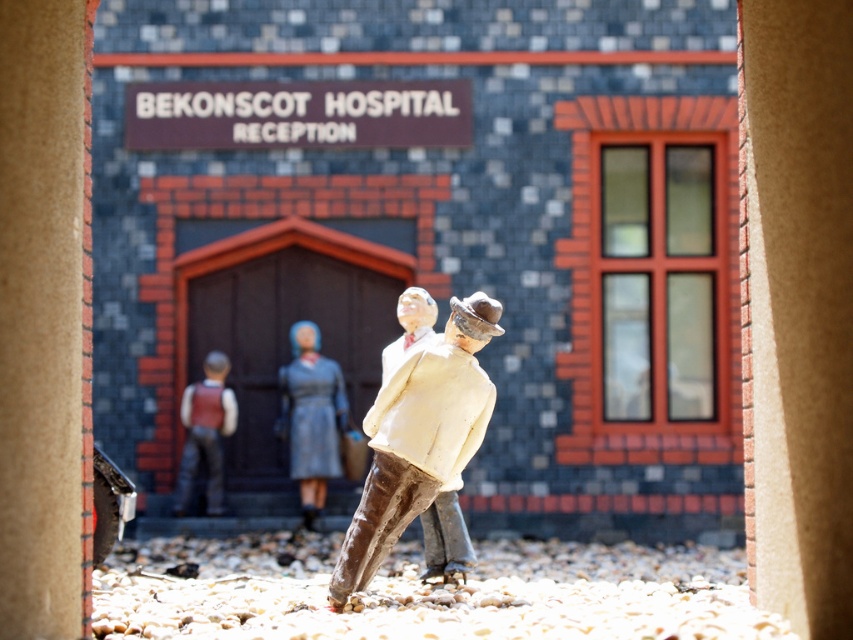
You are a visitor at BEKONSCOT HOSPITAL RECEPTION. You see a point marked at coordinates [312,417]. What object is located at that point?

The point at coordinates [312,417] is located on the matte gray dress at center.

You are a visitor at BEKONSCOT HOSPITAL RECEPTION and you see the two figurines in the foreground. Which of the two, the matte gray dress at center or the matte brown vest at center, is positioned higher?

The matte gray dress at center is located above the matte brown vest at center, so the matte gray dress at center is positioned higher.

You are a visitor at BEKONSCOT HOSPITAL RECEPTION and you see the brown leather boot at center and the matte brown vest at center. Which object is covering the other one?

The brown leather boot at center is positioned over matte brown vest at center, so the boot is covering the vest.